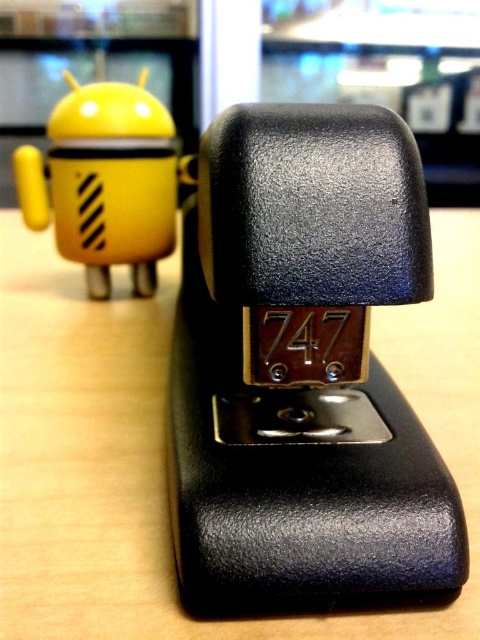
You are standing in front of a desk with a black matte stapler at center. If you want to reach the stapler without moving your feet, can you do it comfortably?

The black matte stapler at center is 26.25 inches away from the viewer. Since this distance is within typical comfortable reaching range for most adults, you can likely reach it without moving your feet.

You are organizing items on a desk and need to place a new item between the black matte stapler at center and the yellow matte android at left. Based on their positions, which object should the new item be placed closer to?

The new item should be placed closer to the yellow matte android at left because the black matte stapler at center is closer to the viewer, meaning the android is farther back, so placing the item closer to the android would maintain the spatial arrangement.

You are organizing items on a desk and need to know which object is taller between the black matte stapler at center and the yellow matte android at left. Can you tell me which one is taller?

The black matte stapler at center is taller than the yellow matte android at left according to the description.